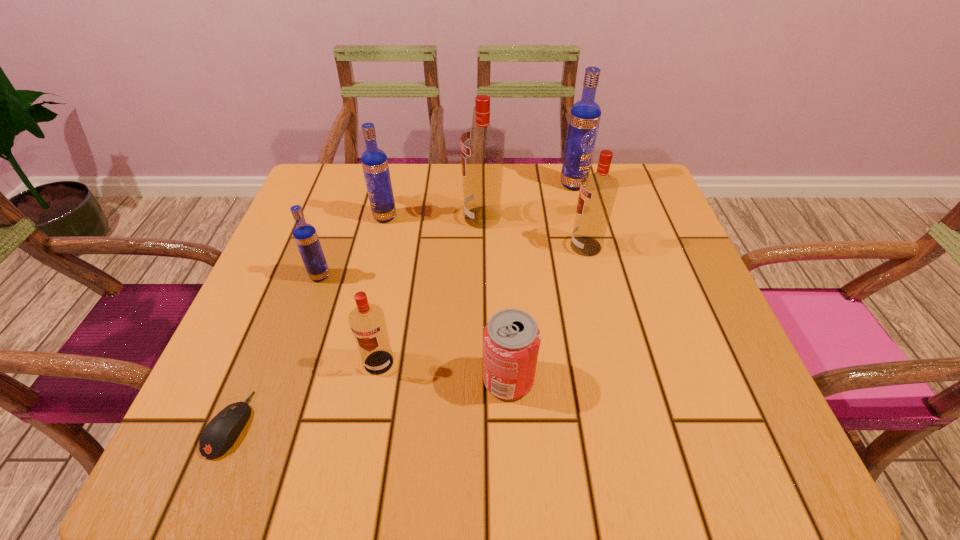
This screenshot has height=540, width=960. I want to click on blank space located on the front label of the third nearest vodka, so click(x=525, y=246).

This screenshot has width=960, height=540. Identify the location of vacant region located on the front label of the third nearest vodka. (416, 246).

The image size is (960, 540). I want to click on free region located on the front label of the third nearest vodka, so click(x=516, y=246).

Find the location of a particular element. vacant space situated on the front of the second object from left to right is located at coordinates (275, 406).

The width and height of the screenshot is (960, 540). Identify the location of vacant space located on the front label of the smallest red vodka. 363,450.

In order to click on free spot located on the left of the soda can in this screenshot , I will do `click(293, 379)`.

What are the coordinates of `vacant space located on the back of the shortest object` in the screenshot? It's located at (260, 353).

The image size is (960, 540). Identify the location of object present at the near edge. (219, 435).

This screenshot has height=540, width=960. In order to click on vodka present at the left edge in this screenshot , I will do `click(305, 235)`.

Where is `computer mouse that is positioned at the left edge`? computer mouse that is positioned at the left edge is located at coordinates (219, 435).